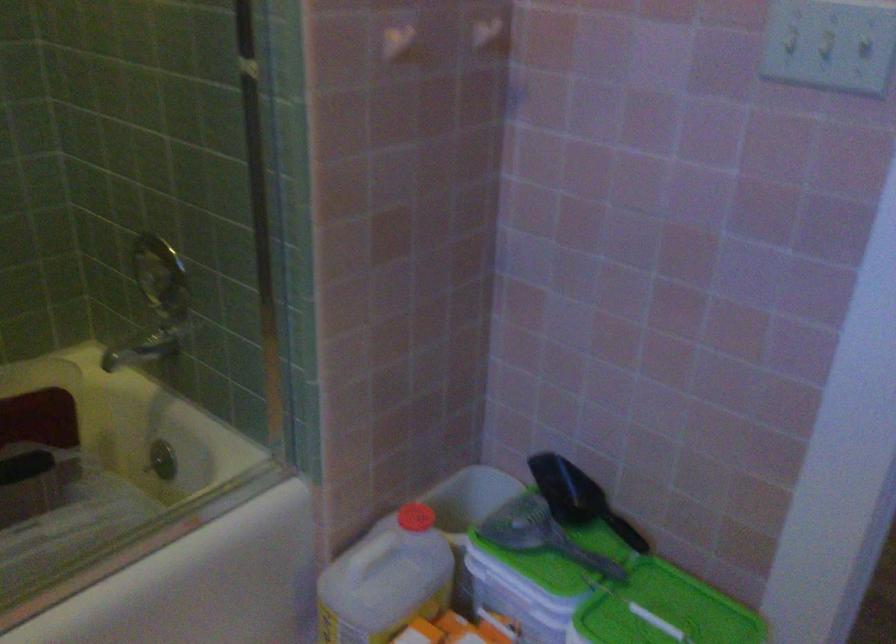
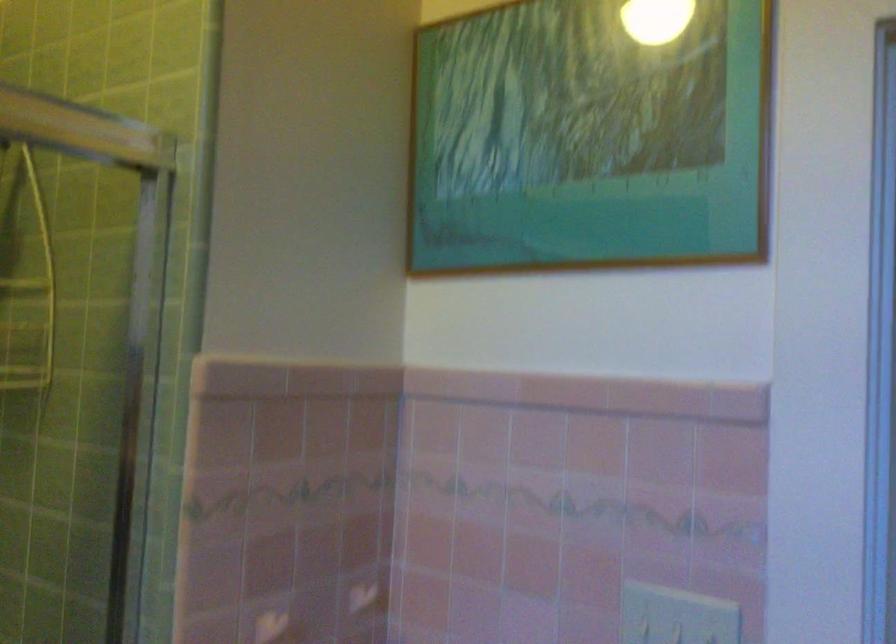
Question: The first image is from the beginning of the video and the second image is from the end. How did the camera likely rotate when shooting the video?

Choices:
 (A) Left
 (B) Right
 (C) Up
 (D) Down

Answer: (C)